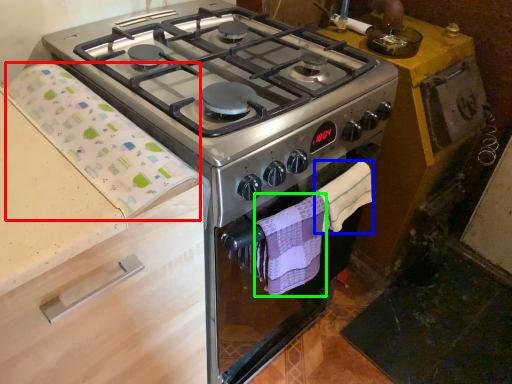
Question: Based on their relative distances, which object is nearer to blanket (highlighted by a red box)? Choose from hand towel (highlighted by a blue box) and hand towel (highlighted by a green box).

Choices:
 (A) hand towel
 (B) hand towel

Answer: (B)